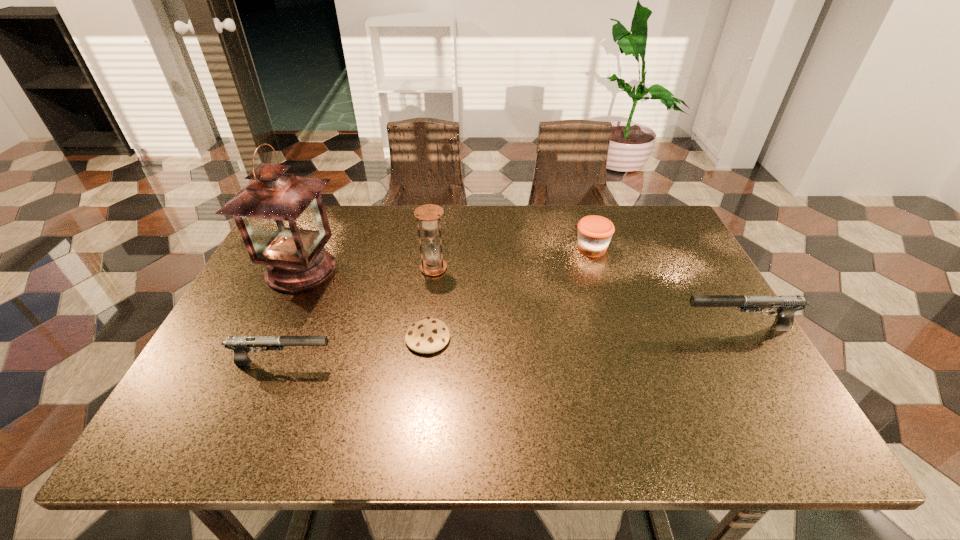
At what (x,y) coordinates should I click in order to perform the action: click on free space located 0.220m at the muzzle end of the fourth shortest object. Please return your answer as a coordinate pair (x, y). The height and width of the screenshot is (540, 960). Looking at the image, I should click on (589, 327).

The image size is (960, 540). I want to click on vacant region located 0.190m at the muzzle end of the fourth shortest object, so click(602, 327).

The image size is (960, 540). I want to click on vacant region located 0.070m on the front of the hourglass, so click(430, 295).

You are a GUI agent. You are given a task and a screenshot of the screen. Output one action in this format:
    pyautogui.click(x=<x>, y=<y>)
    Task: Click on the vacant area situated on the front label of the fifth object from left to right
    This screenshot has width=960, height=540.
    Given the screenshot: What is the action you would take?
    pyautogui.click(x=616, y=328)

Where is `free space located on the back of the oil lamp`? The image size is (960, 540). free space located on the back of the oil lamp is located at coordinates (327, 214).

Locate an element on the screen. The width and height of the screenshot is (960, 540). vacant space located 0.100m on the left of the shortest object is located at coordinates (363, 338).

In order to click on jam that is at the far edge in this screenshot , I will do `click(594, 232)`.

What are the coordinates of `oil lamp positioned at the far edge` in the screenshot? It's located at (281, 217).

This screenshot has height=540, width=960. In order to click on gun at the left edge in this screenshot , I will do `click(240, 345)`.

Find the location of a particular element. This screenshot has width=960, height=540. oil lamp that is at the left edge is located at coordinates (281, 217).